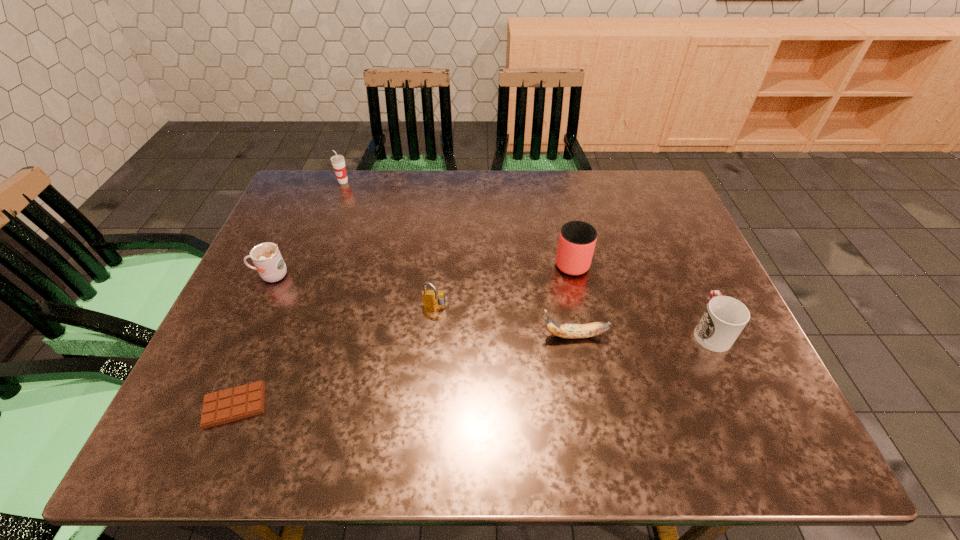
The width and height of the screenshot is (960, 540). Find the location of `empty space between the leftmost cup and the shortest object`. empty space between the leftmost cup and the shortest object is located at coordinates (252, 340).

Find the location of a particular element. This screenshot has height=540, width=960. free space between the third cup from left to right and the farthest cup is located at coordinates (457, 221).

Locate an element on the screen. This screenshot has height=540, width=960. vacant space in between the leftmost cup and the padlock is located at coordinates (352, 292).

Locate an element on the screen. object that stands as the fourth closest to the banana is located at coordinates (244, 401).

Choose which object is the nearest neighbor to the candy bar. Please provide its 2D coordinates. Your answer should be formatted as a tuple, i.e. [(x, y)], where the tuple contains the x and y coordinates of a point satisfying the conditions above.

[(266, 257)]

Where is `the closest cup relative to the second cup from right to left`? the closest cup relative to the second cup from right to left is located at coordinates (724, 318).

You are a GUI agent. You are given a task and a screenshot of the screen. Output one action in this format:
    pyautogui.click(x=<x>, y=<y>)
    Task: Click on the third closest cup to the candy bar
    This screenshot has width=960, height=540.
    Given the screenshot: What is the action you would take?
    pyautogui.click(x=338, y=162)

At what (x,y) coordinates should I click in order to perform the action: click on vacant area in the image that satisfies the following two spatial constraints: 1. on the side with the handle of the leftmost cup; 2. on the handle side of the rightmost object. Please return your answer as a coordinate pair (x, y). Image resolution: width=960 pixels, height=540 pixels. Looking at the image, I should click on (246, 331).

This screenshot has width=960, height=540. In order to click on vacant space that satisfies the following two spatial constraints: 1. on the side with the handle of the leftmost cup; 2. on the back side of the nearest object in this screenshot , I will do `click(211, 406)`.

Identify the location of vacant space that satisfies the following two spatial constraints: 1. at the stem of the banana; 2. on the front side of the candy bar. (588, 406).